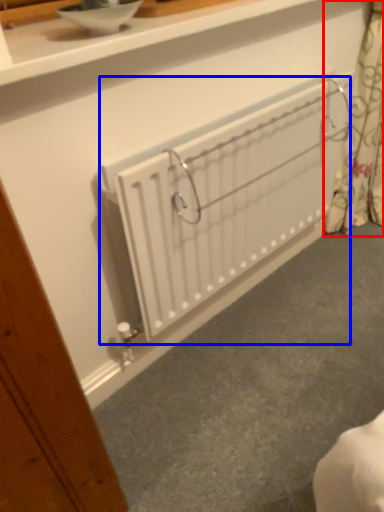
Question: Which point is closer to the camera, curtain (highlighted by a red box) or radiator (highlighted by a blue box)?

Choices:
 (A) curtain
 (B) radiator

Answer: (B)